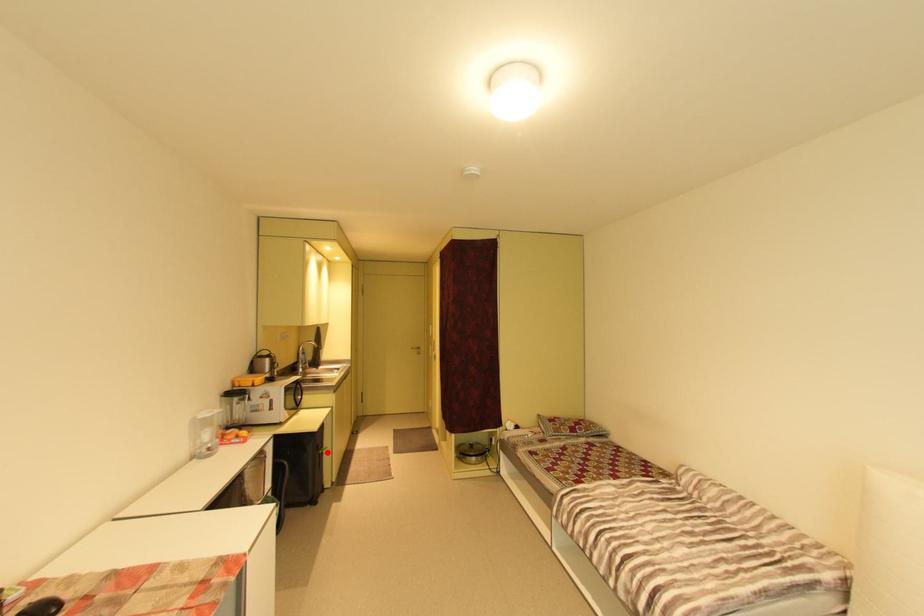
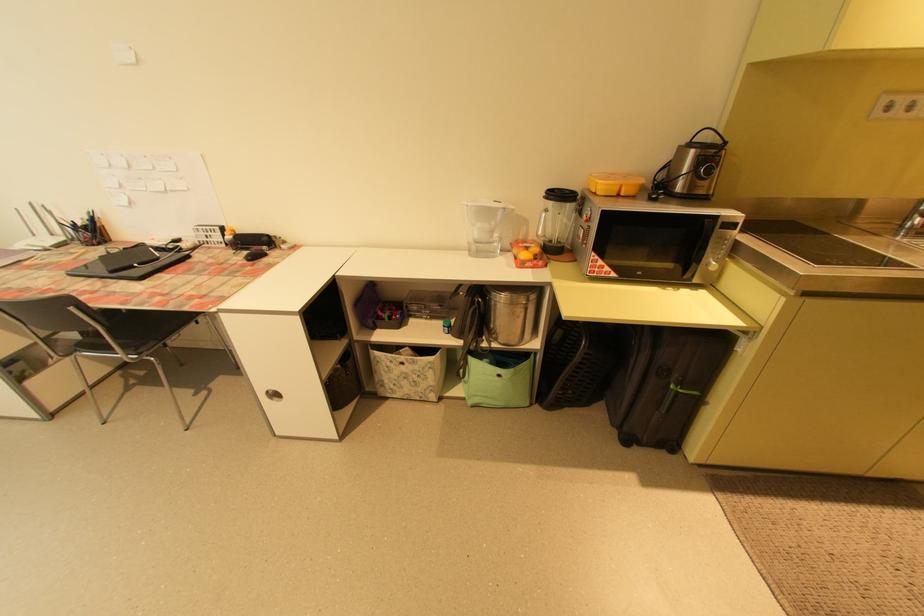
Find the pixel in the second image that matches the highlighted location in the first image.

(678, 387)